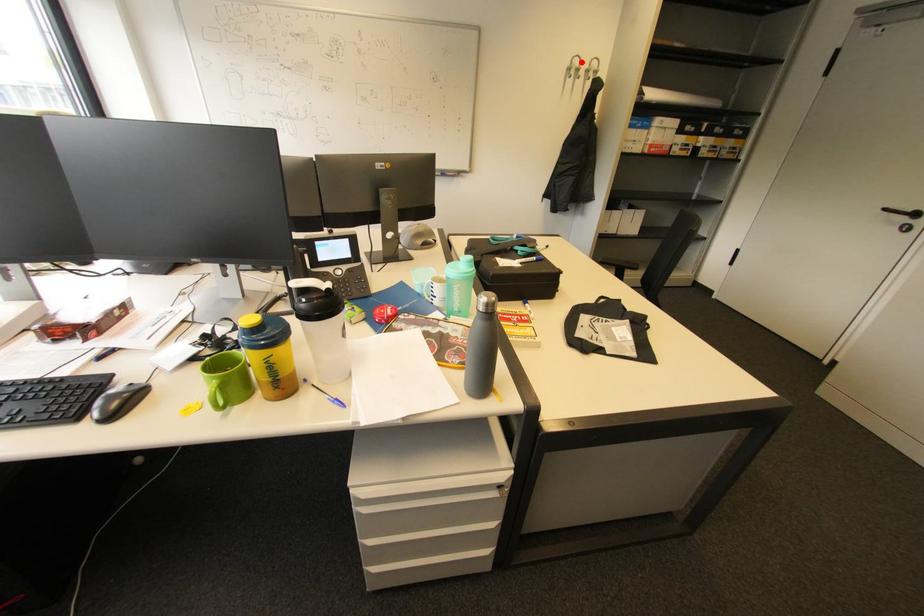
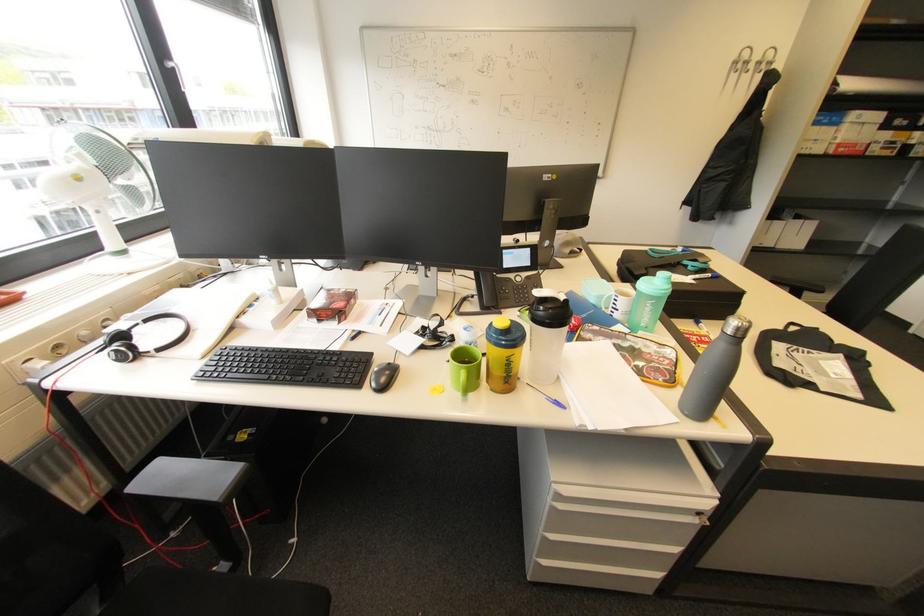
Where in the second image is the point corresponding to the highlighted location from the first image?

(751, 54)